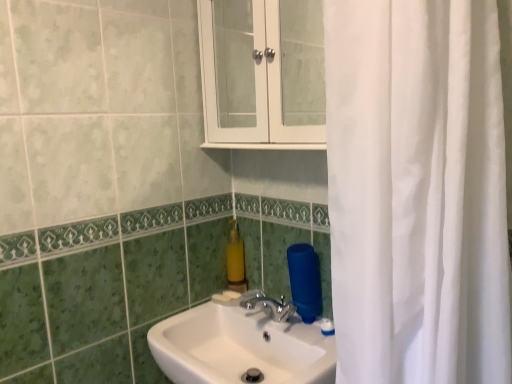
Find the location of `white glossy cabinet at upper center`. white glossy cabinet at upper center is located at coordinates (263, 72).

What do you see at coordinates (263, 72) in the screenshot?
I see `white glossy cabinet at upper center` at bounding box center [263, 72].

Find the location of a particular element. This screenshot has height=384, width=512. white glossy sink at center is located at coordinates (242, 344).

Is white glossy cabinet at upper center far away from white glossy sink at center?

No, white glossy cabinet at upper center is not far from white glossy sink at center.

Can you confirm if white glossy cabinet at upper center is shorter than white glossy sink at center?

Incorrect, the height of white glossy cabinet at upper center does not fall short of that of white glossy sink at center.

This screenshot has height=384, width=512. In the image, there is a white glossy cabinet at upper center. Find the location of `sink below it (from the image's perspective)`. sink below it (from the image's perspective) is located at coordinates (242, 344).

Between white glossy cabinet at upper center and white glossy sink at center, which one appears on the left side from the viewer's perspective?

white glossy sink at center.

Locate an element on the screen. sink below the white glossy cabinet at upper center (from a real-world perspective) is located at coordinates (242, 344).

Considering the relative sizes of white glossy sink at center and white glossy cabinet at upper center in the image provided, is white glossy sink at center bigger than white glossy cabinet at upper center?

Yes, white glossy sink at center is bigger than white glossy cabinet at upper center.

From the image's perspective, would you say white glossy sink at center is shown under white glossy cabinet at upper center?

Correct, white glossy sink at center appears lower than white glossy cabinet at upper center in the image.

Which point is more distant from viewer, (328, 361) or (298, 61)?

The point (298, 61) is more distant.

From a real-world perspective, which object rests below the other?

white glossy sink at center.

Do you think white glossy sink at center is within yellow matte soap dispenser at center, or outside of it?

white glossy sink at center is located beyond the bounds of yellow matte soap dispenser at center.

From the picture: Considering the relative sizes of white glossy sink at center and yellow matte soap dispenser at center in the image provided, is white glossy sink at center smaller than yellow matte soap dispenser at center?

No, white glossy sink at center is not smaller than yellow matte soap dispenser at center.

Is white glossy sink at center positioned with its back to yellow matte soap dispenser at center?

No, white glossy sink at center is not facing away from yellow matte soap dispenser at center.

Who is smaller, yellow matte soap dispenser at center or white glossy sink at center?

Smaller between the two is yellow matte soap dispenser at center.

Locate an element on the screen. This screenshot has width=512, height=384. soap dispenser above the white glossy sink at center (from the image's perspective) is located at coordinates (234, 260).

Choose the correct answer: Is yellow matte soap dispenser at center inside white glossy sink at center or outside it?

The correct answer is: outside.

Is white glossy cabinet at upper center located within yellow matte soap dispenser at center?

Actually, white glossy cabinet at upper center is outside yellow matte soap dispenser at center.

Is point (234, 277) positioned after point (305, 82)?

No.

Could you tell me if yellow matte soap dispenser at center is turned towards white glossy cabinet at upper center?

No, yellow matte soap dispenser at center does not turn towards white glossy cabinet at upper center.

From the image's perspective, is yellow matte soap dispenser at center located beneath white glossy cabinet at upper center?

Yes.

Between white glossy cabinet at upper center and yellow matte soap dispenser at center, which one appears on the left side from the viewer's perspective?

yellow matte soap dispenser at center.

Could yellow matte soap dispenser at center be considered to be inside white glossy cabinet at upper center?

Definitely not — yellow matte soap dispenser at center is not inside white glossy cabinet at upper center.

Is white glossy cabinet at upper center smaller than yellow matte soap dispenser at center?

No.

Identify the location of medicine cabinet above the yellow matte soap dispenser at center (from a real-world perspective). (263, 72).

What are the coordinates of `sink on the left of white glossy cabinet at upper center` in the screenshot? It's located at (242, 344).

The width and height of the screenshot is (512, 384). I want to click on medicine cabinet located on the right of white glossy sink at center, so click(263, 72).

Which object lies nearer to the anchor point white glossy sink at center, yellow matte soap dispenser at center or white glossy cabinet at upper center?

yellow matte soap dispenser at center lies closer to white glossy sink at center than the other object.

Looking at the image, which one is located further to white glossy cabinet at upper center, yellow matte soap dispenser at center or white glossy sink at center?

white glossy sink at center lies further to white glossy cabinet at upper center than the other object.

Considering their positions, is white glossy sink at center positioned further to white glossy cabinet at upper center than yellow matte soap dispenser at center?

white glossy sink at center lies further to white glossy cabinet at upper center than the other object.

Considering their positions, is white glossy cabinet at upper center positioned further to white glossy sink at center than yellow matte soap dispenser at center?

The object further to white glossy sink at center is white glossy cabinet at upper center.

Looking at the image, which one is located closer to yellow matte soap dispenser at center, white glossy cabinet at upper center or white glossy sink at center?

Based on the image, white glossy sink at center appears to be nearer to yellow matte soap dispenser at center.

Estimate the real-world distances between objects in this image. Which object is further from yellow matte soap dispenser at center, white glossy sink at center or white glossy cabinet at upper center?

white glossy cabinet at upper center is positioned further to the anchor yellow matte soap dispenser at center.

This screenshot has width=512, height=384. I want to click on soap dispenser that lies between white glossy cabinet at upper center and white glossy sink at center from top to bottom, so click(234, 260).